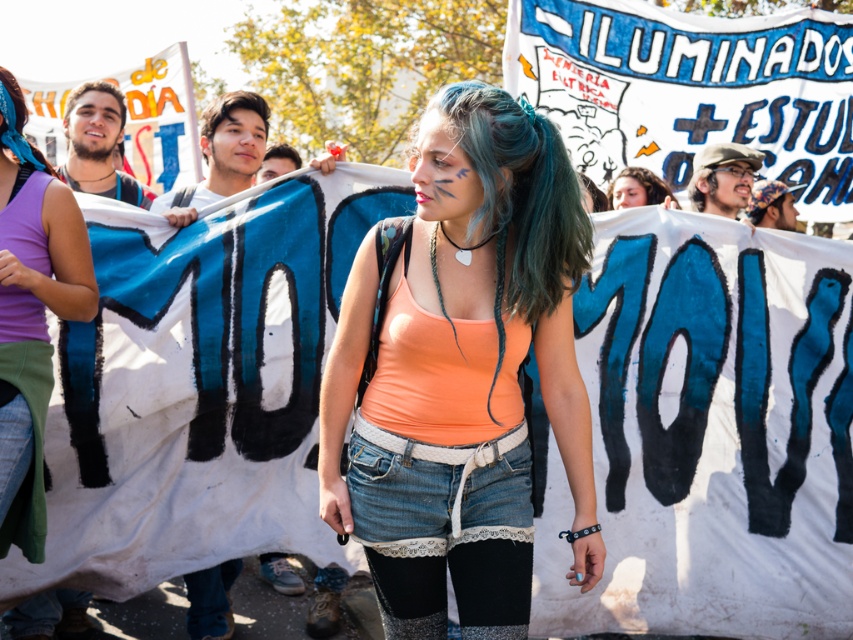
Who is positioned more to the right, matte purple tank top at left or blonde hair at center?

blonde hair at center

Who is more distant from viewer, (19, 184) or (280, 145)?

The point (280, 145) is more distant.

You are a GUI agent. You are given a task and a screenshot of the screen. Output one action in this format:
    pyautogui.click(x=<x>, y=<y>)
    Task: Click on the matte purple tank top at left
    This screenshot has width=853, height=640.
    Given the screenshot: What is the action you would take?
    pyautogui.click(x=32, y=314)

Does point (482, 148) lie in front of point (99, 92)?

That is True.

Where is `blue dyed hair at center`? The image size is (853, 640). blue dyed hair at center is located at coordinates (520, 193).

What do you see at coordinates (461, 371) in the screenshot? I see `orange matte tank top at center` at bounding box center [461, 371].

Is orange matte tank top at center below matte purple tank top at left?

Yes, orange matte tank top at center is below matte purple tank top at left.

Looking at this image, who is more forward, (426, 129) or (9, 202)?

Point (426, 129) is more forward.

Find the location of `orange matte tank top at center`. orange matte tank top at center is located at coordinates click(461, 371).